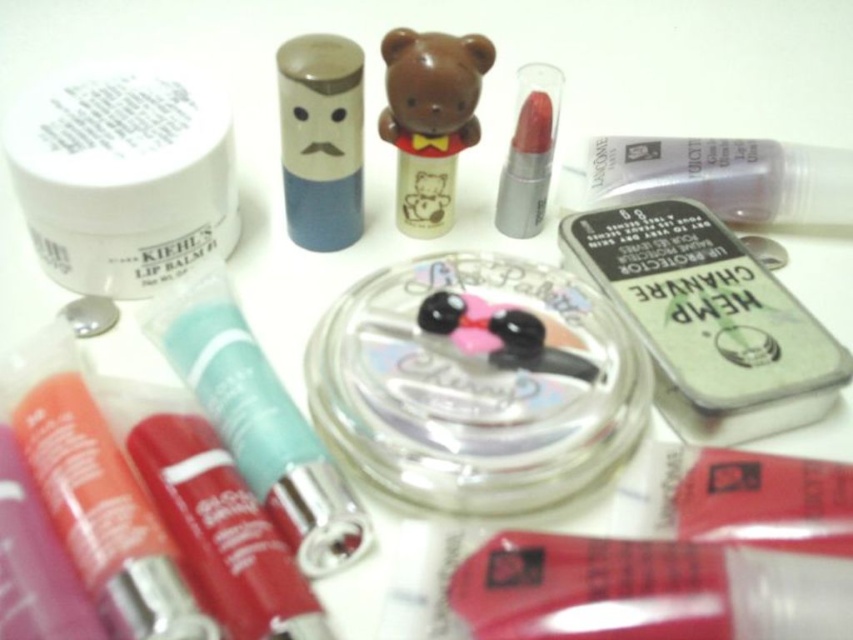
Question: Is clear plastic container at center wider than shiny plastic lip balm at lower left?

Choices:
 (A) yes
 (B) no

Answer: (A)

Question: Considering the real-world distances, which object is farthest from the clear plastic tube at upper right?

Choices:
 (A) matte silver lipstick at upper center
 (B) brown matte bear at center
 (C) clear plastic container at center

Answer: (C)

Question: Does shiny plastic lip balm at lower left have a larger size compared to matte silver lipstick at upper center?

Choices:
 (A) yes
 (B) no

Answer: (A)

Question: Which point appears farthest from the camera in this image?

Choices:
 (A) (74, 560)
 (B) (323, 118)

Answer: (B)

Question: Is shiny red lipstick at center to the right of clear plastic tube at upper right from the viewer's perspective?

Choices:
 (A) no
 (B) yes

Answer: (A)

Question: Among these objects, which one is farthest from the camera?

Choices:
 (A) teal matte lip balm at lower left
 (B) blue matte lipstick at center

Answer: (B)